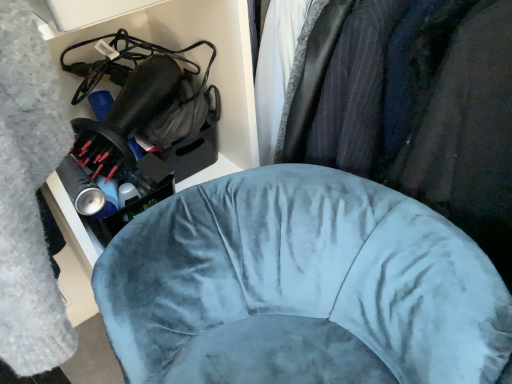
Question: Considering the relative positions of velvet blue chair at center and velvet blue chair at center in the image provided, is velvet blue chair at center behind velvet blue chair at center?

Choices:
 (A) no
 (B) yes

Answer: (B)

Question: Considering the relative sizes of velvet blue chair at center and velvet blue chair at center in the image provided, is velvet blue chair at center thinner than velvet blue chair at center?

Choices:
 (A) no
 (B) yes

Answer: (B)

Question: From a real-world perspective, is velvet blue chair at center below velvet blue chair at center?

Choices:
 (A) yes
 (B) no

Answer: (A)

Question: Is velvet blue chair at center oriented towards velvet blue chair at center?

Choices:
 (A) no
 (B) yes

Answer: (A)

Question: Is velvet blue chair at center located outside velvet blue chair at center?

Choices:
 (A) no
 (B) yes

Answer: (B)

Question: From the image's perspective, is velvet blue chair at center under velvet blue chair at center?

Choices:
 (A) no
 (B) yes

Answer: (B)

Question: From the image's perspective, is velvet blue chair at center above velvet blue chair at center?

Choices:
 (A) yes
 (B) no

Answer: (A)

Question: Does velvet blue chair at center have a smaller size compared to velvet blue chair at center?

Choices:
 (A) yes
 (B) no

Answer: (B)

Question: From the image's perspective, is velvet blue chair at center under velvet blue chair at center?

Choices:
 (A) no
 (B) yes

Answer: (A)

Question: Does velvet blue chair at center have a greater width compared to velvet blue chair at center?

Choices:
 (A) no
 (B) yes

Answer: (B)

Question: Does velvet blue chair at center lie behind velvet blue chair at center?

Choices:
 (A) yes
 (B) no

Answer: (B)

Question: Is velvet blue chair at center closer to camera compared to velvet blue chair at center?

Choices:
 (A) yes
 (B) no

Answer: (A)

Question: From a real-world perspective, relative to velvet blue chair at center, is velvet blue chair at center vertically above or below?

Choices:
 (A) below
 (B) above

Answer: (B)